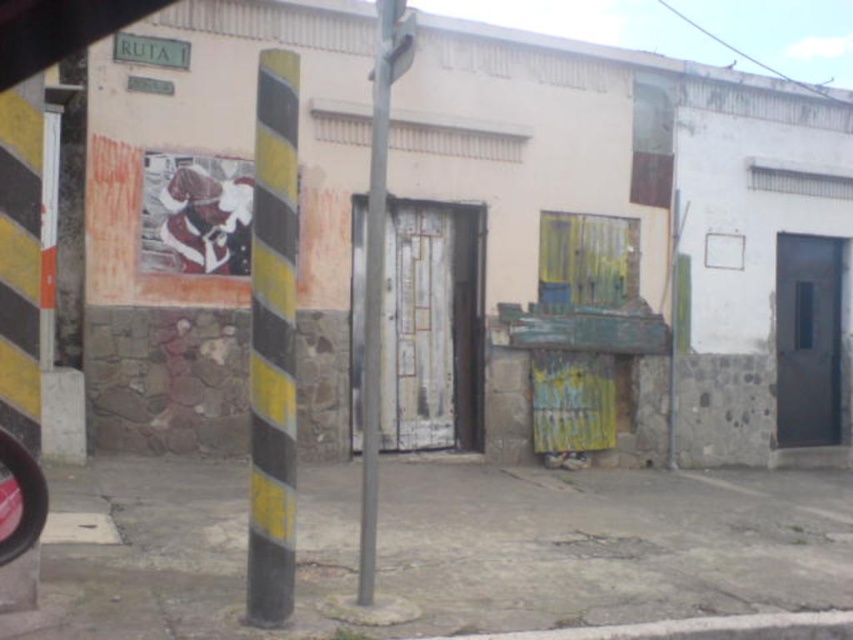
Question: Which point appears closest to the camera in this image?

Choices:
 (A) (175, 44)
 (B) (763, 604)
 (C) (393, 24)

Answer: (C)

Question: Is concrete pavement at center thinner than metallic gray pole at center?

Choices:
 (A) no
 (B) yes

Answer: (A)

Question: Does yellow/black striped pole at left come in front of metallic gray pole at center?

Choices:
 (A) yes
 (B) no

Answer: (A)

Question: Based on their relative distances, which object is farther from the metallic gray pole at center?

Choices:
 (A) green plastic sign at upper left
 (B) concrete pavement at center
 (C) yellow/black striped pole at left

Answer: (A)

Question: Which of the following is the farthest from the observer?

Choices:
 (A) green plastic sign at upper left
 (B) yellow/black striped pole at left
 (C) metallic gray pole at center

Answer: (A)

Question: Where is concrete pavement at center located in relation to green plastic sign at upper left in the image?

Choices:
 (A) right
 (B) left

Answer: (A)